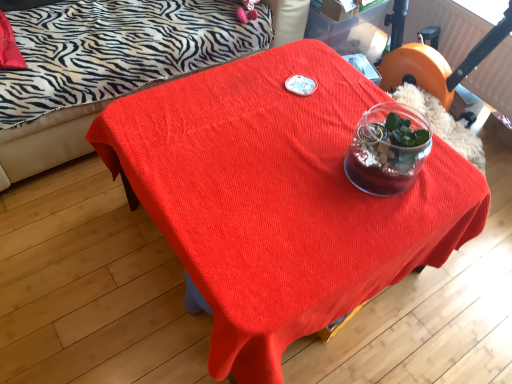
Identify the location of matte red table at center. (280, 198).

From a real-world perspective, which is physically below, matte red table at center or zebra-patterned fabric couch at upper left?

matte red table at center, from a real-world perspective.

Would you say matte red table at center is a long distance from zebra-patterned fabric couch at upper left?

Actually, matte red table at center and zebra-patterned fabric couch at upper left are a little close together.

Which object is thinner, matte red table at center or zebra-patterned fabric couch at upper left?

With smaller width is matte red table at center.

Between matte red table at center and zebra-patterned fabric couch at upper left, which one has less height?

matte red table at center is shorter.

From a real-world perspective, who is located higher, orange plastic swivel chair at upper right or zebra-patterned fabric couch at upper left?

zebra-patterned fabric couch at upper left.

From the picture: Is orange plastic swivel chair at upper right next to zebra-patterned fabric couch at upper left?

They are not placed beside each other.

Is orange plastic swivel chair at upper right to the right of zebra-patterned fabric couch at upper left from the viewer's perspective?

Correct, you'll find orange plastic swivel chair at upper right to the right of zebra-patterned fabric couch at upper left.

From the image's perspective, is orange plastic swivel chair at upper right located beneath zebra-patterned fabric couch at upper left?

Yes, from the image's perspective, orange plastic swivel chair at upper right is below zebra-patterned fabric couch at upper left.

Looking at this image, measure the distance between zebra-patterned fabric couch at upper left and matte red table at center.

zebra-patterned fabric couch at upper left and matte red table at center are 25.13 inches apart from each other.

Can you confirm if zebra-patterned fabric couch at upper left is positioned to the right of matte red table at center?

In fact, zebra-patterned fabric couch at upper left is to the left of matte red table at center.

Is zebra-patterned fabric couch at upper left oriented towards matte red table at center?

Yes, zebra-patterned fabric couch at upper left faces towards matte red table at center.

From a real-world perspective, is zebra-patterned fabric couch at upper left physically located above or below orange plastic swivel chair at upper right?

In terms of real-world spatial position, zebra-patterned fabric couch at upper left is above orange plastic swivel chair at upper right.

Between point (272, 4) and point (449, 67), which one is positioned in front?

The point (272, 4) is more forward.

Which is in front, zebra-patterned fabric couch at upper left or orange plastic swivel chair at upper right?

Positioned in front is zebra-patterned fabric couch at upper left.

Is there a large distance between zebra-patterned fabric couch at upper left and orange plastic swivel chair at upper right?

zebra-patterned fabric couch at upper left is positioned a significant distance from orange plastic swivel chair at upper right.

The image size is (512, 384). I want to click on swivel chair positioned vertically above the matte red table at center (from a real-world perspective), so click(x=434, y=58).

From a real-world perspective, is orange plastic swivel chair at upper right under matte red table at center?

Actually, orange plastic swivel chair at upper right is physically above matte red table at center in the real world.

In the scene shown: Between orange plastic swivel chair at upper right and matte red table at center, which one has less height?

With less height is orange plastic swivel chair at upper right.

Consider the image. Would you say matte red table at center is a long distance from orange plastic swivel chair at upper right?

No, matte red table at center is not far away from orange plastic swivel chair at upper right.

From a real-world perspective, is matte red table at center under orange plastic swivel chair at upper right?

Yes.

Is matte red table at center thinner than orange plastic swivel chair at upper right?

No.

Locate an element on the screen. The image size is (512, 384). studio couch located on the left of matte red table at center is located at coordinates (46, 142).

Find the location of a particular element. The height and width of the screenshot is (384, 512). swivel chair located behind the zebra-patterned fabric couch at upper left is located at coordinates tap(434, 58).

Which object lies nearer to the anchor point zebra-patterned fabric couch at upper left, orange plastic swivel chair at upper right or matte red table at center?

matte red table at center is closer to zebra-patterned fabric couch at upper left.

Looking at the image, which one is located further to orange plastic swivel chair at upper right, matte red table at center or zebra-patterned fabric couch at upper left?

The object further to orange plastic swivel chair at upper right is zebra-patterned fabric couch at upper left.

When comparing their distances from matte red table at center, does zebra-patterned fabric couch at upper left or orange plastic swivel chair at upper right seem closer?

zebra-patterned fabric couch at upper left.

Considering their positions, is zebra-patterned fabric couch at upper left positioned closer to orange plastic swivel chair at upper right than matte red table at center?

matte red table at center is positioned closer to the anchor orange plastic swivel chair at upper right.

Based on the photo, considering their positions, is matte red table at center positioned further to zebra-patterned fabric couch at upper left than orange plastic swivel chair at upper right?

Based on the image, orange plastic swivel chair at upper right appears to be further to zebra-patterned fabric couch at upper left.

Based on their spatial positions, is orange plastic swivel chair at upper right or zebra-patterned fabric couch at upper left closer to matte red table at center?

zebra-patterned fabric couch at upper left.

In order to click on desk situated between zebra-patterned fabric couch at upper left and orange plastic swivel chair at upper right from left to right in this screenshot , I will do `click(280, 198)`.